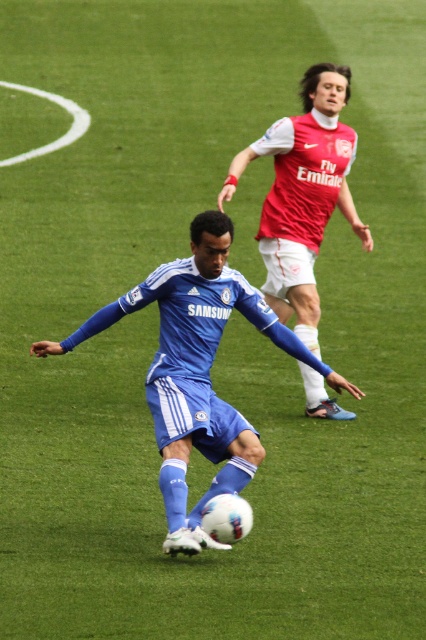
You are a soccer coach observing the match. You notice the matte blue uniform at center and the red jersey at upper right. Which player is closer to the center of the field?

The matte blue uniform at center is closer to the center of the field than the red jersey at upper right.